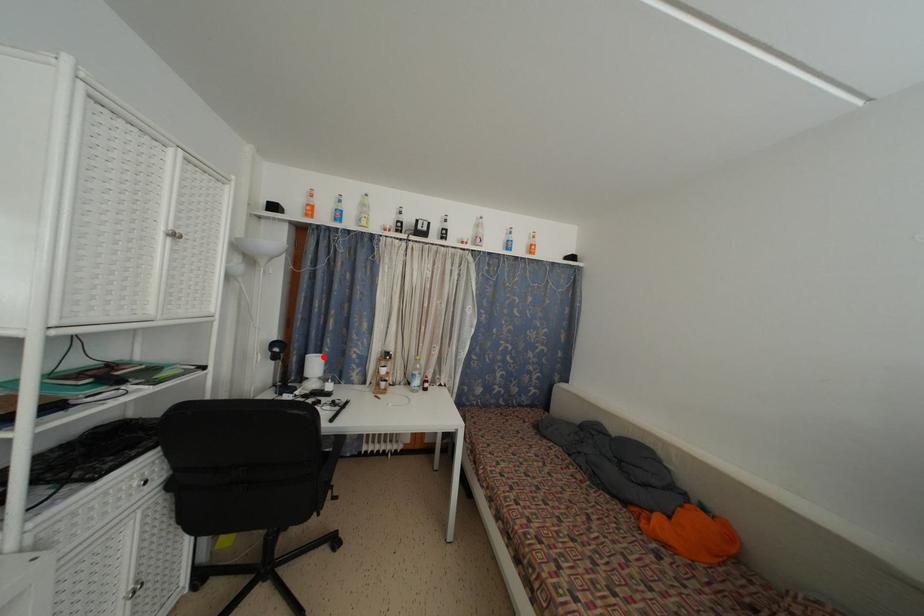
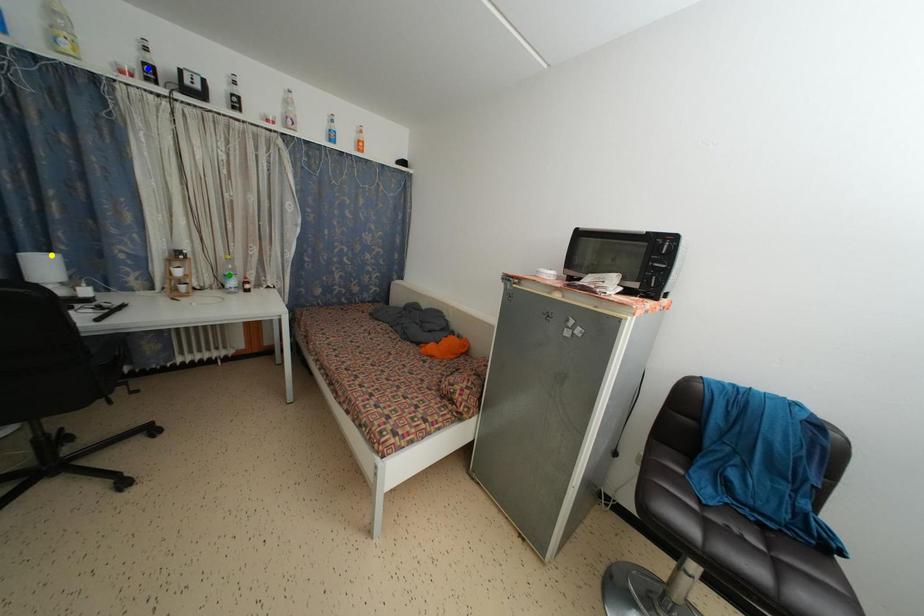
Question: I am providing you with two images of the same scene from different viewpoints. A red point is marked on the first image. You are given multiple points on the second image. Which spot in image 2 lines up with the point in image 1?

Choices:
 (A) blue point
 (B) yellow point
 (C) green point

Answer: (B)